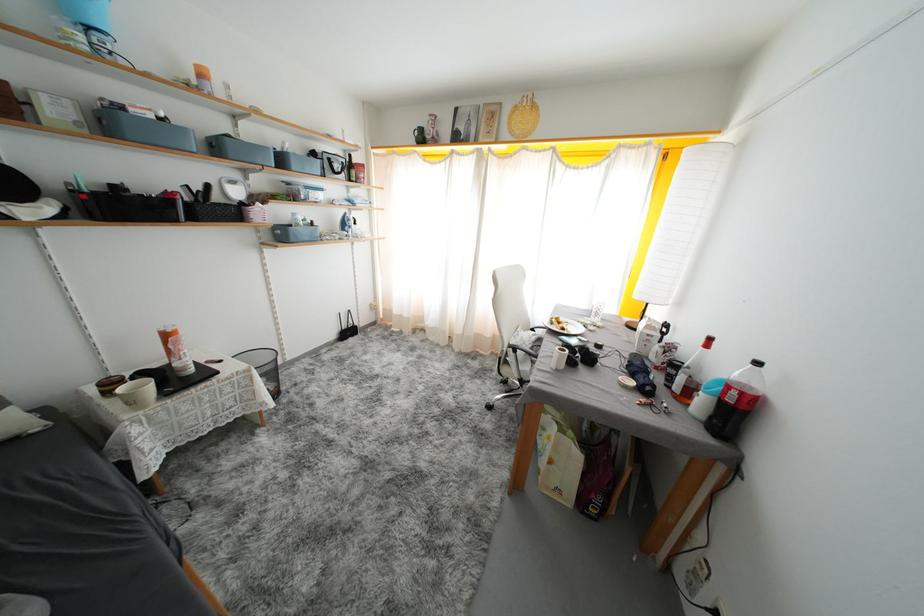
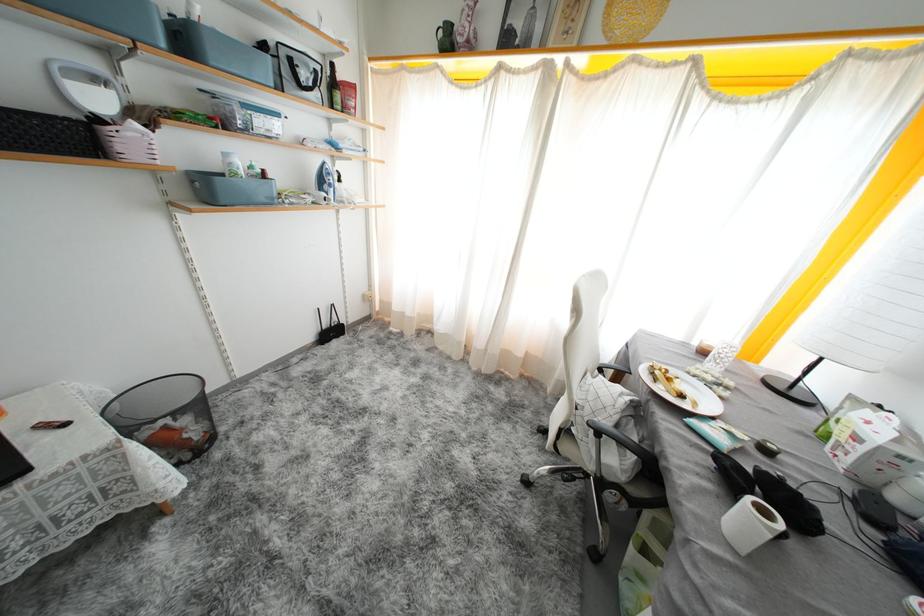
Find the pixel in the second image that matches (225,363) in the first image.

(70, 423)